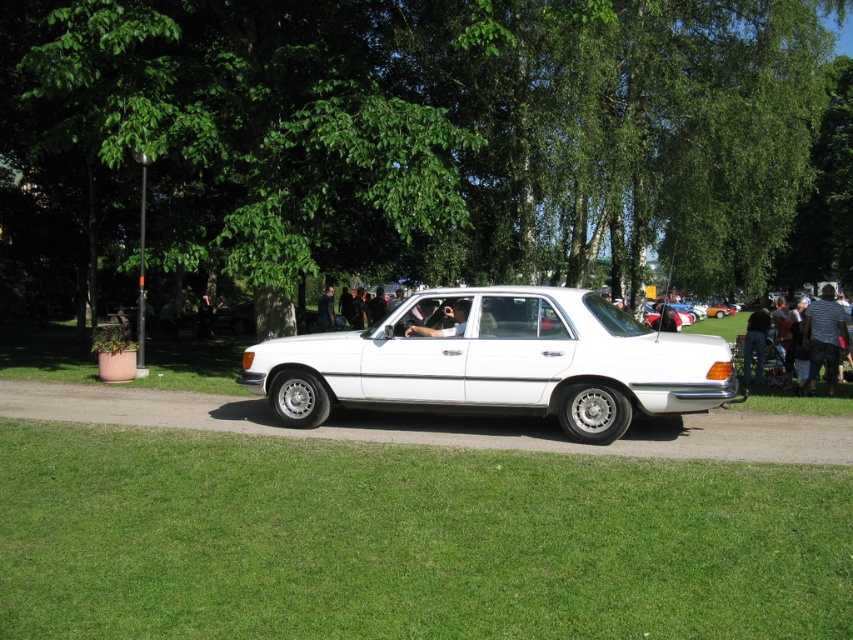
You are standing on the grassy lawn and see the white glossy sedan at center and the striped shirt at right. Which object is closer to your left side?

The white glossy sedan at center is closer to your left side because it is positioned to the left of the striped shirt at right.

You are standing at the edge of the image and want to walk towards the green grass at lower center. Which direction should you move in?

The green grass at lower center is located at point 0.845 on the x axis and 0.478 on the y axis. Since you are at the edge, you should move towards the center of the image to reach it.

In the scene shown: You are a photographer planning to take a picture of the white glossy sedan at center and the striped shirt at right. Based on their sizes in the image, which object will appear smaller in the photo?

The white glossy sedan at center will appear smaller in the photo because it is thinner than the striped shirt at right.